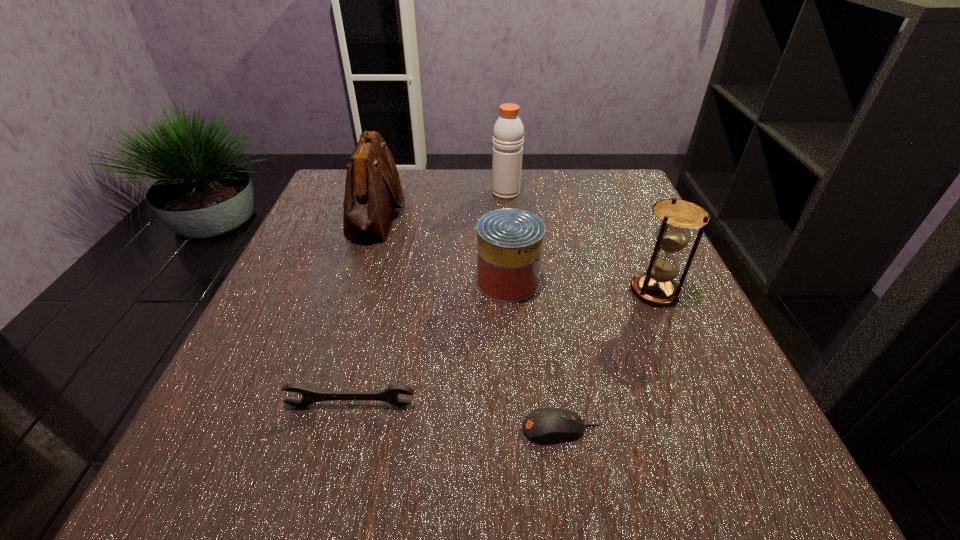
Locate an element on the screen. The width and height of the screenshot is (960, 540). vacant space that's between the third shortest object and the rightmost object is located at coordinates (581, 286).

You are a GUI agent. You are given a task and a screenshot of the screen. Output one action in this format:
    pyautogui.click(x=<x>, y=<y>)
    Task: Click on the free point between the wrench and the hourglass
    The height and width of the screenshot is (540, 960).
    Given the screenshot: What is the action you would take?
    point(502,348)

The width and height of the screenshot is (960, 540). I want to click on unoccupied position between the wrench and the rightmost object, so click(x=502, y=348).

You are a GUI agent. You are given a task and a screenshot of the screen. Output one action in this format:
    pyautogui.click(x=<x>, y=<y>)
    Task: Click on the unoccupied position between the third shortest object and the second nearest object
    The width and height of the screenshot is (960, 540).
    Given the screenshot: What is the action you would take?
    pyautogui.click(x=429, y=343)

The image size is (960, 540). What are the coordinates of `empty location between the shaker and the rightmost object` in the screenshot? It's located at (580, 242).

Where is `vacant space in between the rightmost object and the shaker`? The width and height of the screenshot is (960, 540). vacant space in between the rightmost object and the shaker is located at coordinates (580, 242).

Locate an element on the screen. This screenshot has width=960, height=540. unoccupied area between the third shortest object and the shortest object is located at coordinates [x=535, y=355].

You are a GUI agent. You are given a task and a screenshot of the screen. Output one action in this format:
    pyautogui.click(x=<x>, y=<y>)
    Task: Click on the object that can be found as the third closest to the shaker
    This screenshot has height=540, width=960.
    Given the screenshot: What is the action you would take?
    pyautogui.click(x=656, y=286)

At what (x,y) coordinates should I click in order to perform the action: click on object that is the fourth closest to the fifth farthest object. Please return your answer as a coordinate pair (x, y). This screenshot has width=960, height=540. Looking at the image, I should click on (656, 286).

Image resolution: width=960 pixels, height=540 pixels. In order to click on vacant space that satisfies the following two spatial constraints: 1. on the open ends of the wrench; 2. on the left side of the shortest object in this screenshot , I will do `click(345, 429)`.